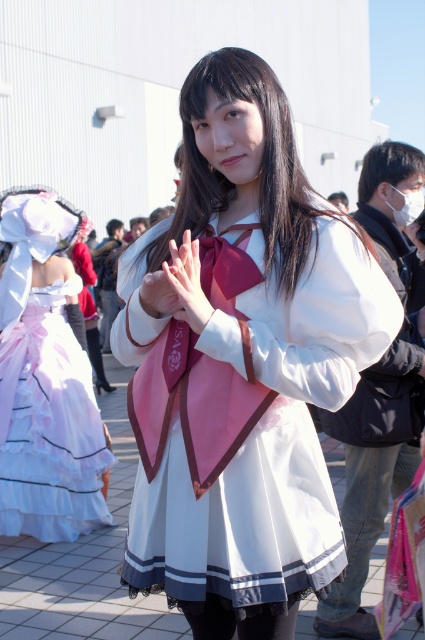
You are a photographer at the event and want to capture the white satin dress at center and the pink satin hand at center in a single frame. Given that your camera has a fixed focal length, which object should you position closer to the camera to ensure both fit within the frame?

Since the white satin dress at center is wider than the pink satin hand at center, you should position the white satin dress at center closer to the camera. This way, its larger size will occupy more space in the frame, allowing both objects to fit better within the camera view.

You are a photographer at the event and need to capture a photo that includes both the white lace dress at left and the pink satin hand at center. Since you want to ensure both are visible, which object should you focus on first to account for their sizes?

The white lace dress at left is taller than the pink satin hand at center, so you should focus on the white lace dress at left first to ensure its full height is captured before adjusting for the smaller pink satin hand at center.

You are a photographer standing at the event. You want to take a photo of the white satin dress at center. If your camera has a minimum focus distance of 1.5 meters, will you be able to focus on the dress?

The white satin dress at center is 1.81 meters away from the camera, which is beyond the minimum focus distance of 1.5 meters. Therefore, the camera can focus on the white satin dress at center.